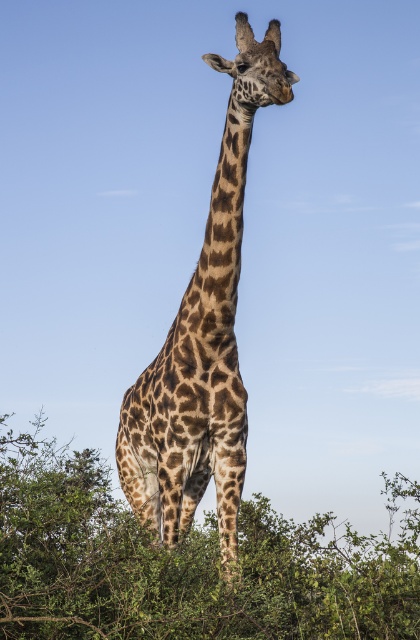
Question: Does green leafy bush at center appear on the left side of spotted fur giraffe at center?

Choices:
 (A) no
 (B) yes

Answer: (B)

Question: Where is green leafy bush at center located in relation to spotted fur giraffe at center in the image?

Choices:
 (A) left
 (B) right

Answer: (A)

Question: Does green leafy bush at center have a lesser width compared to spotted fur giraffe at center?

Choices:
 (A) yes
 (B) no

Answer: (B)

Question: Which point is closer to the camera?

Choices:
 (A) (228, 396)
 (B) (241, 534)

Answer: (A)

Question: Which object is closer to the camera taking this photo?

Choices:
 (A) green leafy bush at center
 (B) spotted fur giraffe at center

Answer: (B)